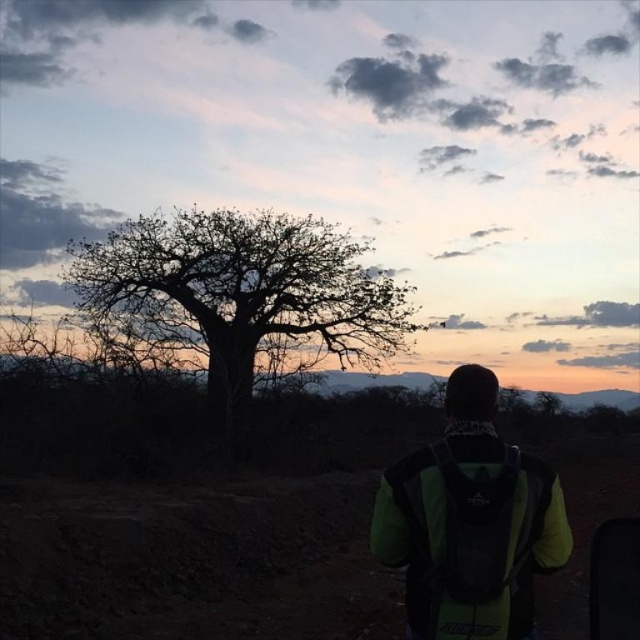
You are planning to take a photo of the silhouette wood tree at center and the green fabric backpack at center in the scene. Which object should you focus on first if you want to capture both in a single frame without moving the camera?

You should focus on the silhouette wood tree at center first because it is wider than the green fabric backpack at center, so it requires a wider angle to capture both in one frame.

From the picture: You are a hiker who wants to take a photo of the silhouette wood tree at center and the green fabric backpack at center. Which object should you adjust your camera to focus on first if you want both to be in the frame?

The silhouette wood tree at center is positioned on the left side of green fabric backpack at center, so you should focus on the silhouette wood tree at center first to ensure both are in the frame.

You are standing at the point closer to the camera in the image. Which point are you at, point [330,276] or point [376,502]?

You are at point [376,502] because point [330,276] is behind it, meaning point [376,502] is closer to the camera.